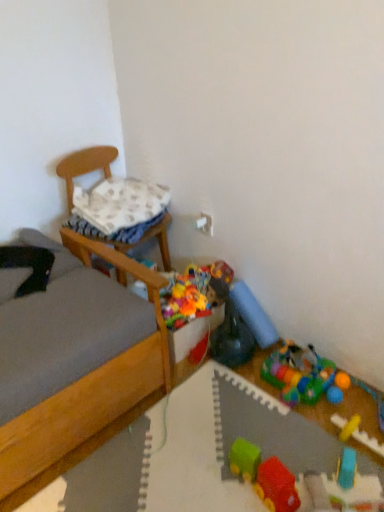
Where is `free location in front of rubber duck at center, which is counted as the fifth toy, starting from the front`? The height and width of the screenshot is (512, 384). free location in front of rubber duck at center, which is counted as the fifth toy, starting from the front is located at coordinates (235, 390).